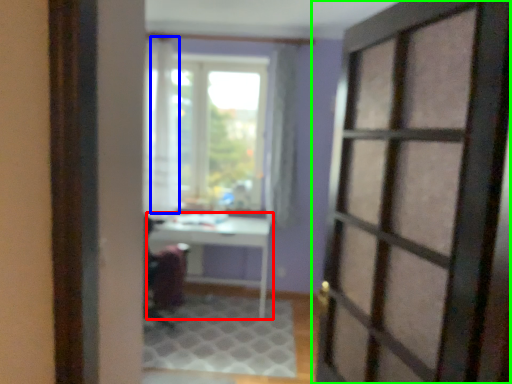
Question: Based on their relative distances, which object is nearer to table (highlighted by a red box)? Choose from curtain (highlighted by a blue box) and door (highlighted by a green box).

Choices:
 (A) curtain
 (B) door

Answer: (A)